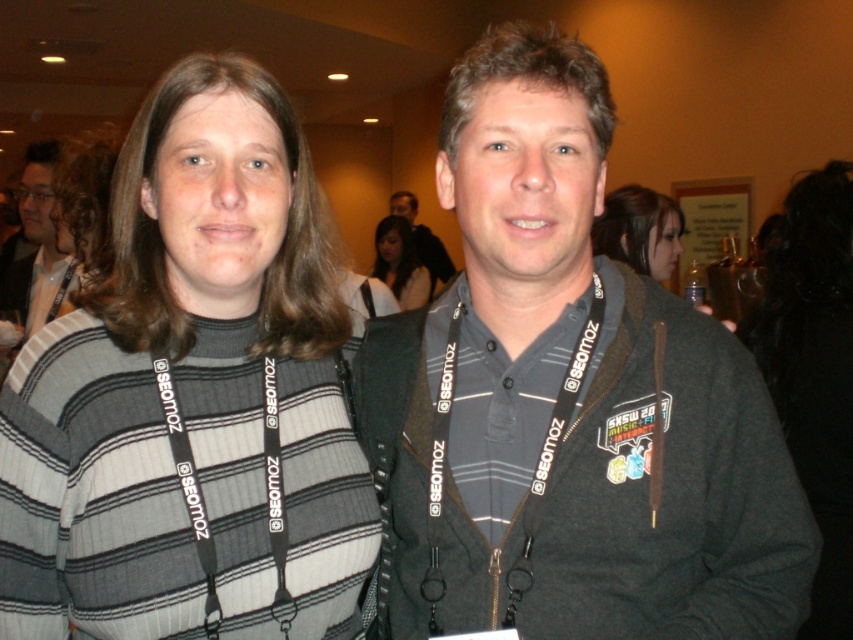
Question: Does black hair at upper right appear on the right side of gray fabric shirt at center?

Choices:
 (A) yes
 (B) no

Answer: (A)

Question: Which point appears closest to the camera in this image?

Choices:
 (A) (625, 225)
 (B) (440, 269)
 (C) (50, 305)

Answer: (A)

Question: In this image, where is matte black lanyard at left located relative to matte black hair at center?

Choices:
 (A) left
 (B) right

Answer: (A)

Question: Which point is farther to the camera?

Choices:
 (A) (286, 528)
 (B) (421, 237)
 (C) (38, 200)

Answer: (B)

Question: Among these points, which one is farthest from the camera?

Choices:
 (A) (170, 326)
 (B) (772, 268)
 (C) (665, 232)
 (D) (444, 269)

Answer: (D)

Question: Does black fabric lanyard at left lie in front of gray fabric shirt at center?

Choices:
 (A) yes
 (B) no

Answer: (A)